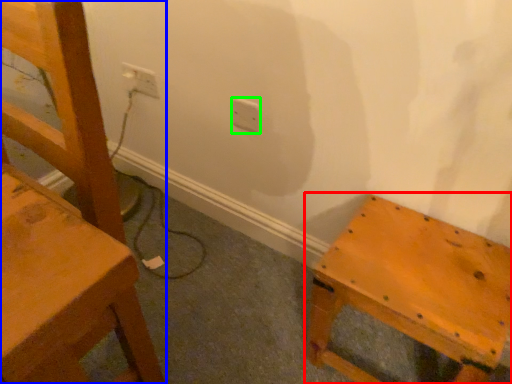
Question: Estimate the real-world distances between objects in this image. Which object is farther from furniture (highlighted by a red box), chair (highlighted by a blue box) or electric outlet (highlighted by a green box)?

Choices:
 (A) chair
 (B) electric outlet

Answer: (B)